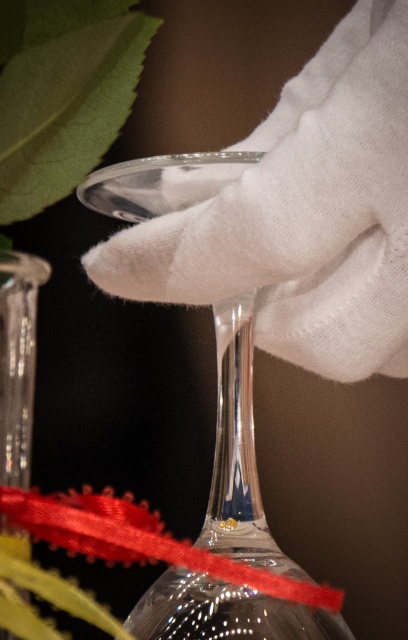
Question: Does white cotton glove at center come in front of transparent glass wine glass at center?

Choices:
 (A) no
 (B) yes

Answer: (B)

Question: Can you confirm if transparent glass wine glass at center is positioned to the right of transparent glass vase at center?

Choices:
 (A) yes
 (B) no

Answer: (A)

Question: Based on their relative distances, which object is nearer to the red satin ribbon at lower center?

Choices:
 (A) transparent glass wine glass at center
 (B) transparent glass vase at center
 (C) white cotton glove at center

Answer: (B)

Question: Which point is farther to the camera?

Choices:
 (A) 246,394
 (B) 117,554
 (C) 13,368
 (D) 121,252

Answer: (A)

Question: Is red satin ribbon at lower center positioned before transparent glass vase at center?

Choices:
 (A) yes
 (B) no

Answer: (A)

Question: Which object is farther from the camera taking this photo?

Choices:
 (A) red satin ribbon at lower center
 (B) transparent glass wine glass at center

Answer: (B)